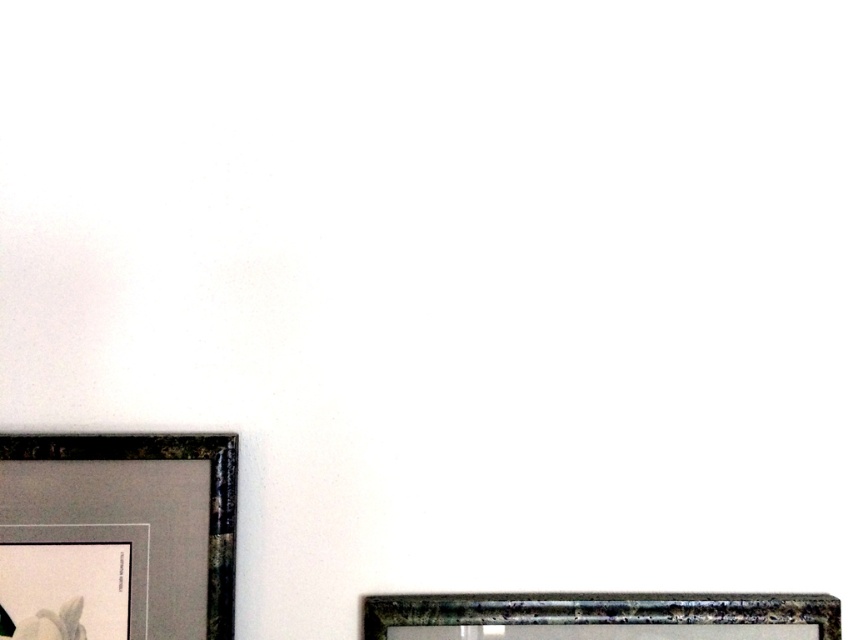
You are hanging a new picture on the wall and need to know the spatial relationship between the metallic gold picture frame at lower left and the metallic silver picture frame at lower right. Which one is closer to the viewer?

The metallic silver picture frame at lower right is closer to the viewer because the metallic gold picture frame at lower left is behind it.

You are standing in a room and want to clean the metallic silver picture frame at lower right. If your cleaning cloth is 2 feet long, can you reach the frame without moving closer?

The metallic silver picture frame at lower right is 3.84 feet away from the viewer. Since the cloth is only 2 feet long, you cannot reach the frame without moving closer.

You are hanging a new picture frame on the wall. The wall has two existing frames, the metallic silver picture frame at lower right and the metallic gold picture frame at lower left. You want to place the new frame between them. Given their sizes, which existing frame should the new frame be closer to?

The metallic silver picture frame at lower right is larger than the metallic gold picture frame at lower left. To maintain symmetry, the new frame should be closer to the smaller metallic gold picture frame at lower left to balance the composition.